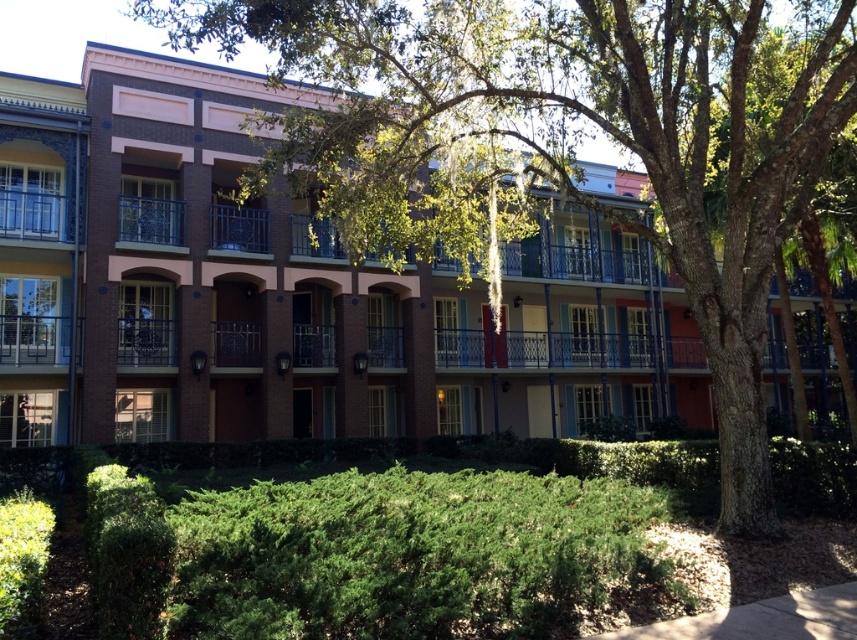
Question: Can you confirm if green leafy tree at center is bigger than green leafy hedge at lower center?

Choices:
 (A) yes
 (B) no

Answer: (B)

Question: Is green leafy tree at center further to the viewer compared to green leafy hedge at lower center?

Choices:
 (A) no
 (B) yes

Answer: (B)

Question: Does green leafy tree at center appear on the right side of metallic wrought iron balcony at center?

Choices:
 (A) yes
 (B) no

Answer: (A)

Question: Which object appears closest to the camera in this image?

Choices:
 (A) green leafy hedge at lower center
 (B) blue painted metal balcony at center

Answer: (A)

Question: Estimate the real-world distances between objects in this image. Which object is farther from the metallic wrought iron balcony at center?

Choices:
 (A) blue painted metal balcony at center
 (B) green leafy tree at center
 (C) green leafy hedge at lower center
 (D) metallic blue balcony at upper left

Answer: (C)

Question: Considering the real-world distances, which object is farthest from the green leafy tree at center?

Choices:
 (A) green leafy hedge at lower center
 (B) metallic blue balcony at upper left

Answer: (B)